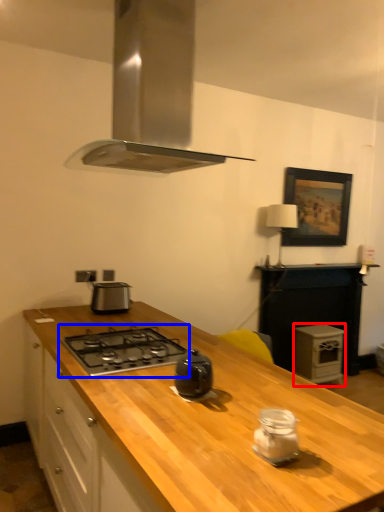
Question: Which point is closer to the camera, appliance (highlighted by a red box) or gas stove (highlighted by a blue box)?

Choices:
 (A) appliance
 (B) gas stove

Answer: (B)